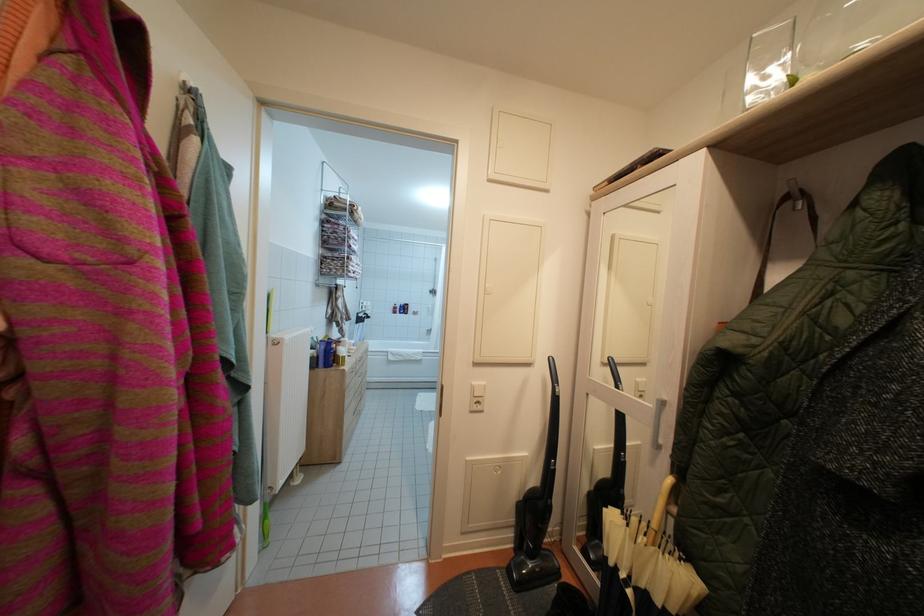
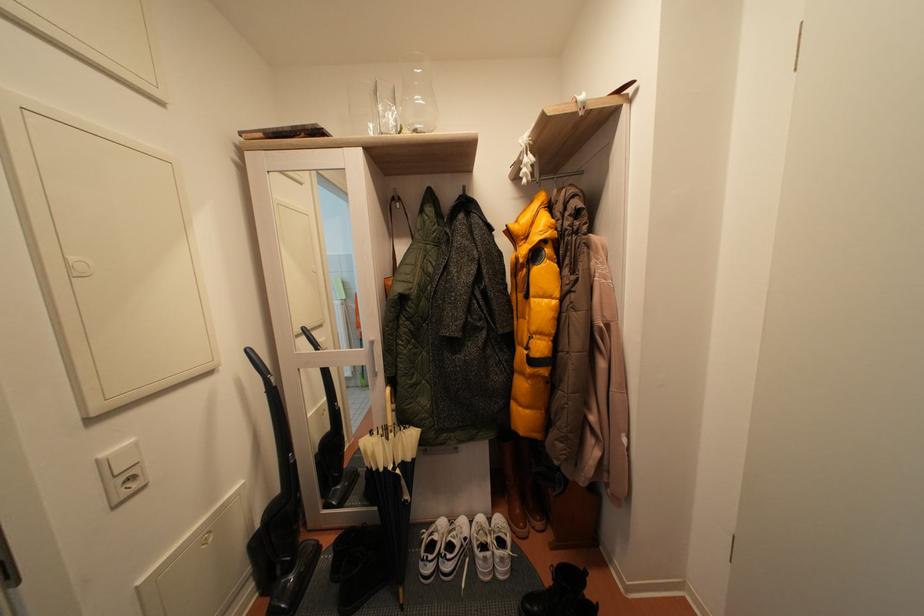
Question: I am providing you with two images of the same scene from different viewpoints. Please identify which objects are invisible in image2.

Choices:
 (A) vacuum cleaner handle
 (B) clear drinking glass
 (C) light switch button
 (D) none of these

Answer: (D)